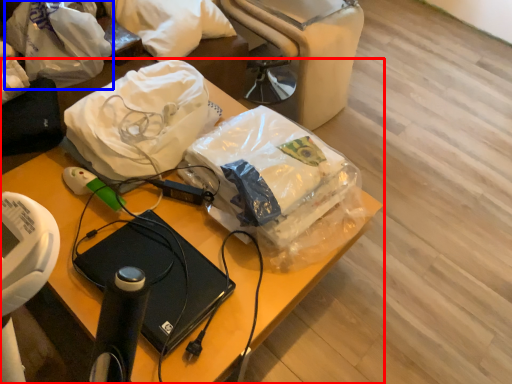
Question: Which point is closer to the camera, furniture (highlighted by a red box) or plastic bag (highlighted by a blue box)?

Choices:
 (A) furniture
 (B) plastic bag

Answer: (A)